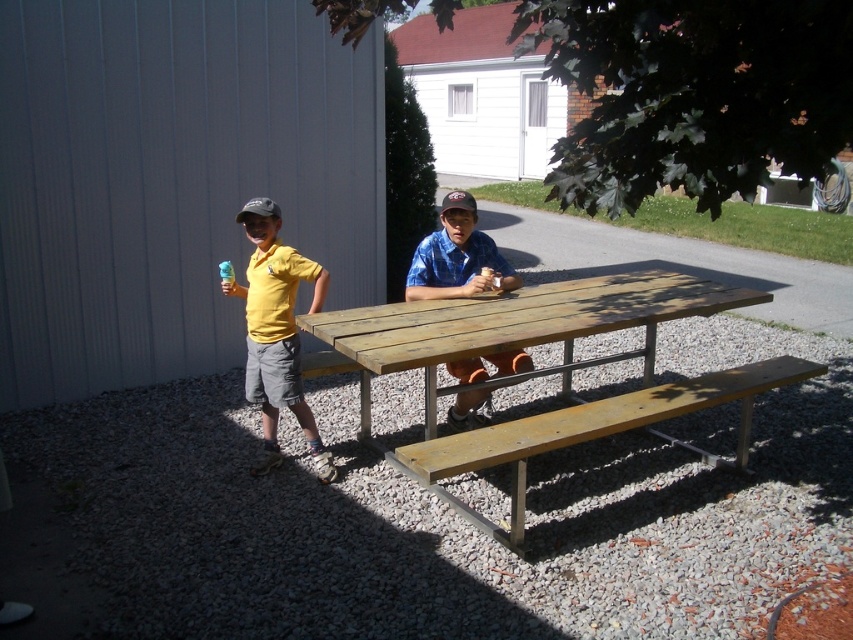
You are standing in front of the weathered wood picnic table at center and want to place a 3.0 meter long object on it. Can you fit the object on the table?

The weathered wood picnic table at center is 2.94 meters from viewer, so the object is slightly longer than the table and cannot be placed entirely on it.

You are a photographer setting up for a group photo. You need to position the yellow matte shirt at left and the blue plaid shirt at center so that they are both visible in the frame. Based on their current positions, which direction should the photographer move to ensure both are in the shot?

The photographer should move to the right because the yellow matte shirt at left is to the left of the blue plaid shirt at center, so moving right will include both in the frame.